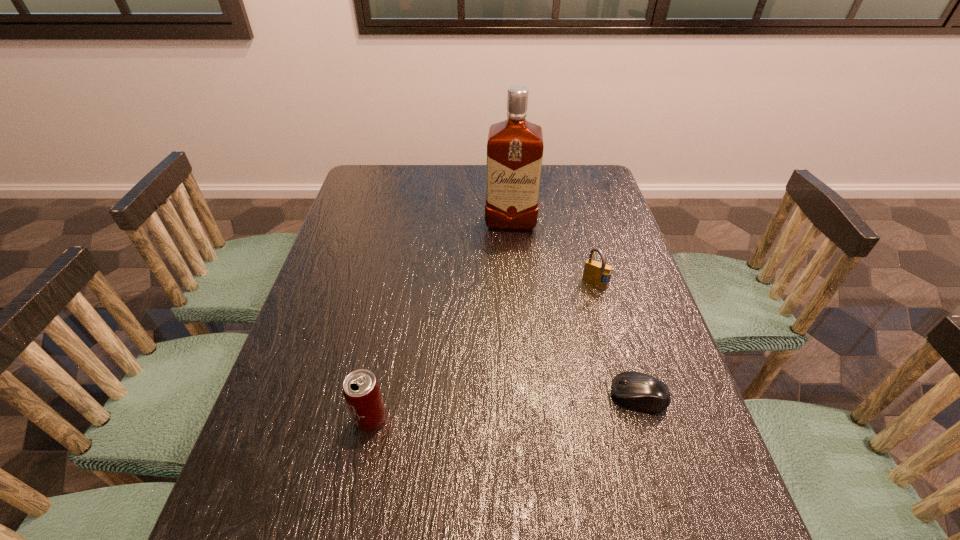
Identify the location of vacant space at the far right corner of the desktop. This screenshot has height=540, width=960. (592, 165).

Locate an element on the screen. Image resolution: width=960 pixels, height=540 pixels. blank region between the third nearest object and the beer can is located at coordinates (483, 352).

Find the location of a particular element. This screenshot has height=540, width=960. empty space that is in between the farthest object and the beer can is located at coordinates (441, 321).

Find the location of `free area in between the beer can and the farthest object`. free area in between the beer can and the farthest object is located at coordinates click(x=441, y=321).

Find the location of a particular element. This screenshot has width=960, height=540. free spot between the mouse and the farthest object is located at coordinates (574, 309).

Where is `vacant area that lies between the tallest object and the third nearest object`? Image resolution: width=960 pixels, height=540 pixels. vacant area that lies between the tallest object and the third nearest object is located at coordinates (553, 253).

I want to click on unoccupied area between the shortest object and the tallest object, so click(574, 309).

Identify the location of vacant area that lies between the beer can and the shortest object. The width and height of the screenshot is (960, 540). (505, 408).

Find the location of a particular element. Image resolution: width=960 pixels, height=540 pixels. free point between the beer can and the second farthest object is located at coordinates (483, 352).

Image resolution: width=960 pixels, height=540 pixels. Find the location of `unoccupied area between the farthest object and the third nearest object`. unoccupied area between the farthest object and the third nearest object is located at coordinates (553, 253).